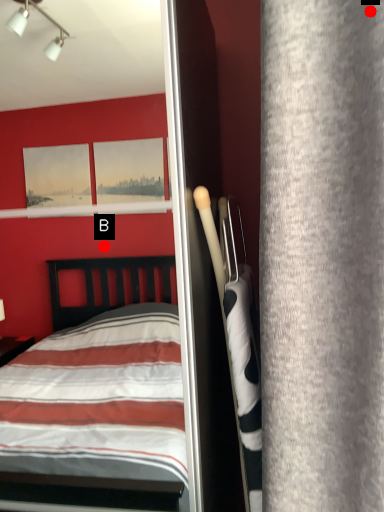
Question: Two points are circled on the image, labeled by A and B beside each circle. Among these points, which one is farthest from the camera?

Choices:
 (A) A is further
 (B) B is further

Answer: (B)